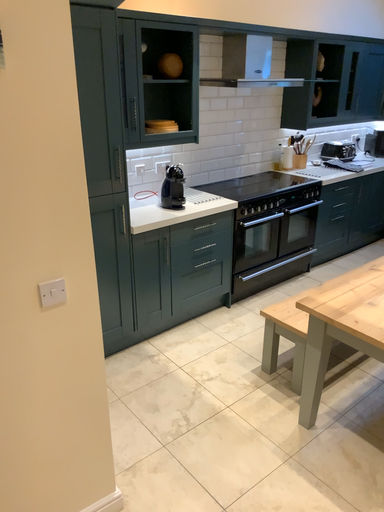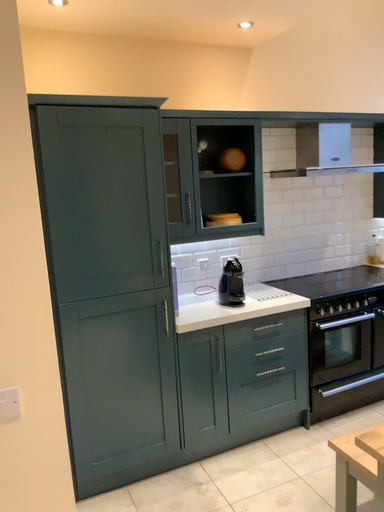
Question: Which way did the camera rotate in the video?

Choices:
 (A) rotated left
 (B) rotated right

Answer: (A)